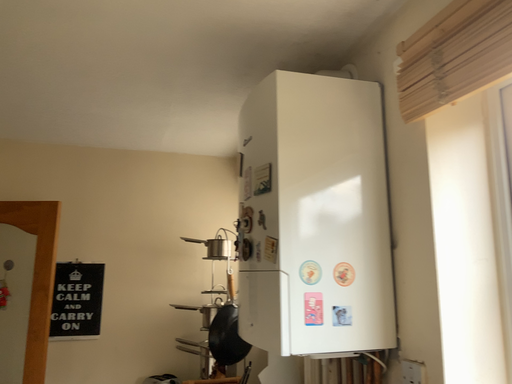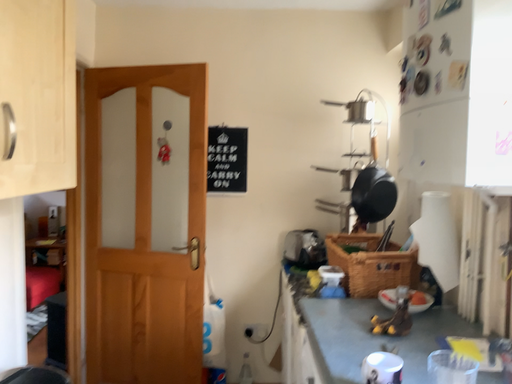
Question: How did the camera likely rotate when shooting the video?

Choices:
 (A) rotated upward
 (B) rotated downward

Answer: (B)